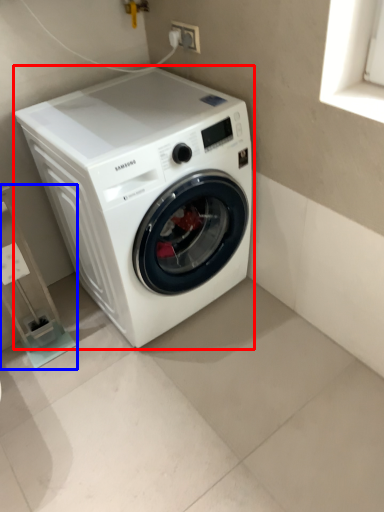
Question: Which point is closer to the camera, washing machine (highlighted by a red box) or shelf (highlighted by a blue box)?

Choices:
 (A) washing machine
 (B) shelf

Answer: (A)